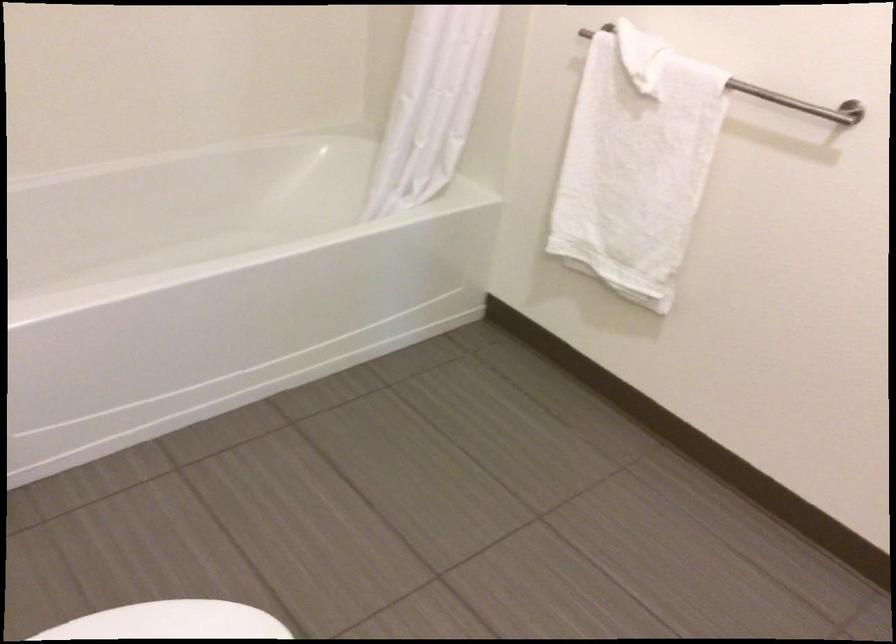
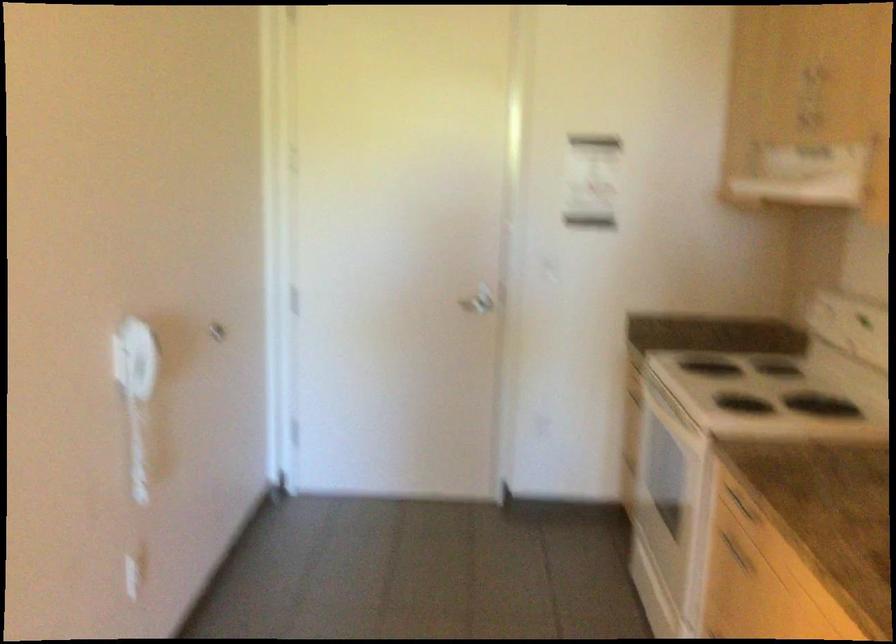
Question: I am providing you with two images of the same scene from different viewpoints. After the viewpoint changes to image2, which objects are now occluded?

Choices:
 (A) silver door handle
 (B) drawer recessed pull
 (C) drawer handle
 (D) white shower curtain

Answer: (D)